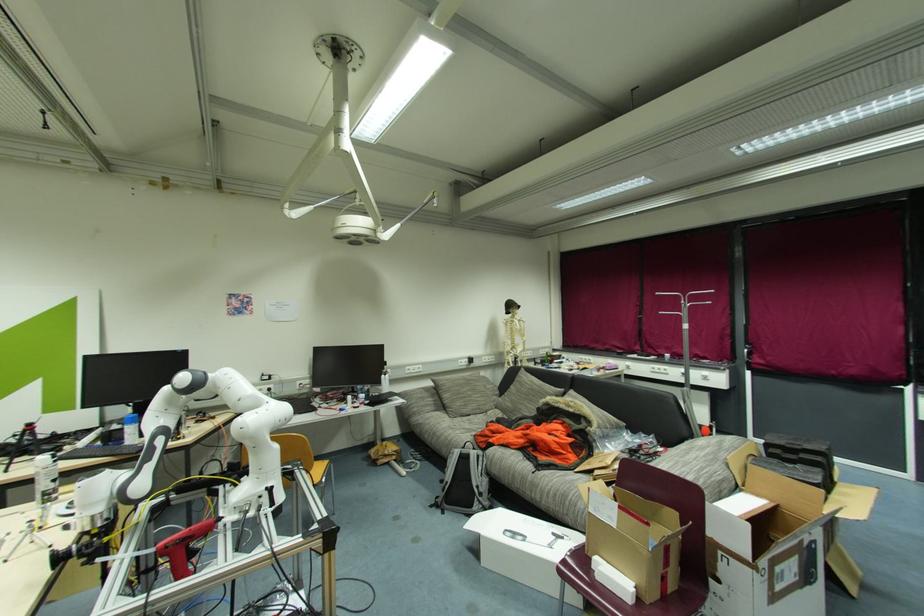
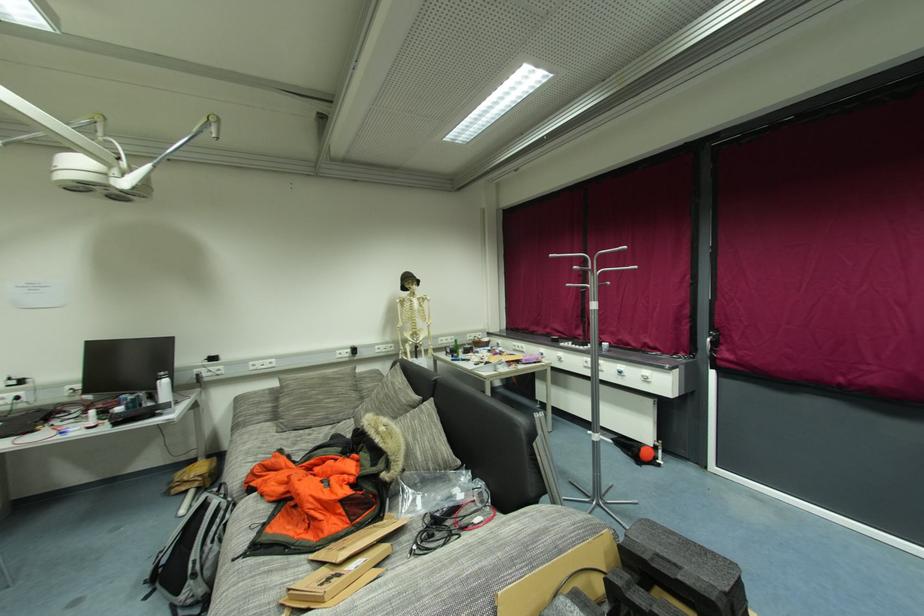
Consider the image. In a continuous first-person perspective shot, in which direction is the camera moving?

The cameraman walked toward right, forward.